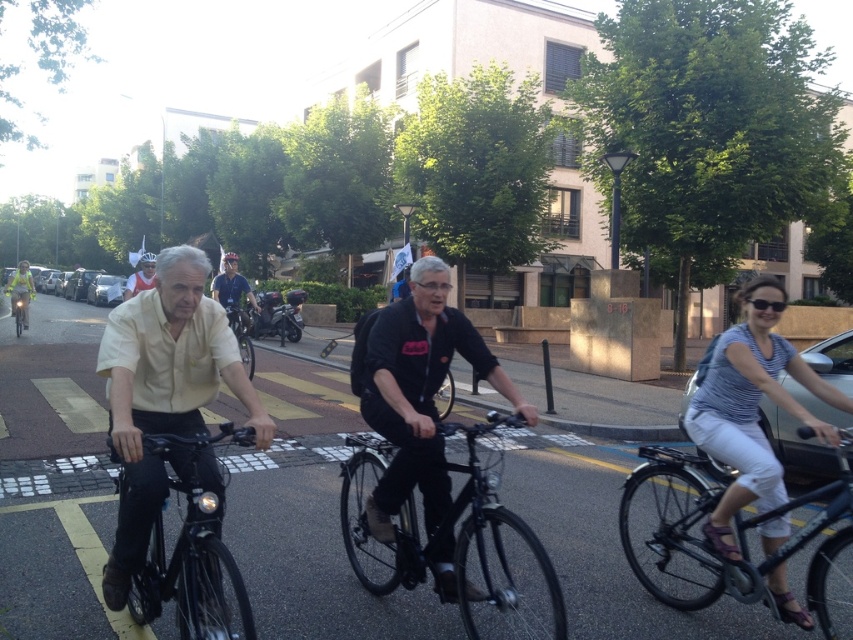
Question: Where is striped cotton shirt at right located in relation to matte blue helmet at center in the image?

Choices:
 (A) above
 (B) below

Answer: (A)

Question: Is shiny black bicycle at center above matte blue helmet at center?

Choices:
 (A) no
 (B) yes

Answer: (A)

Question: Considering the relative positions of black matte jacket at center and white matte bicycle helmet at upper center in the image provided, where is black matte jacket at center located with respect to white matte bicycle helmet at upper center?

Choices:
 (A) left
 (B) right

Answer: (B)

Question: Estimate the real-world distances between objects in this image. Which object is closer to the matte black bicycle at center?

Choices:
 (A) white helmet at center
 (B) shiny black bicycle at center
 (C) black matte bicycle at right

Answer: (B)

Question: Which object appears farthest from the camera in this image?

Choices:
 (A) shiny black bicycle at center
 (B) matte blue helmet at center
 (C) shiny black helmet at center
 (D) shiny blue helmet at upper left

Answer: (C)

Question: Which point is farther to the camera?

Choices:
 (A) (819, 499)
 (B) (408, 472)

Answer: (B)